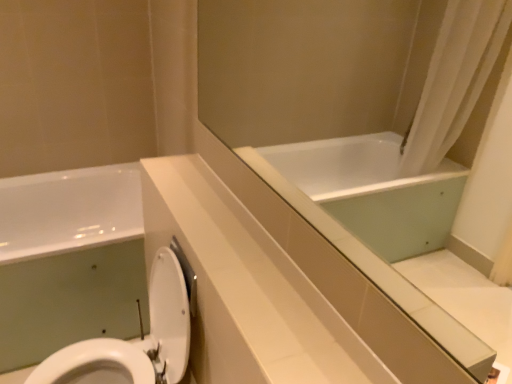
Describe the element at coordinates (69, 260) in the screenshot. I see `white glossy bathtub at lower left` at that location.

Locate an element on the screen. white glossy toilet at lower left is located at coordinates click(x=133, y=340).

From a real-world perspective, does white glossy counter top at center sit lower than white glossy toilet at lower left?

Actually, white glossy counter top at center is physically above white glossy toilet at lower left in the real world.

Which object is further away from the camera, white glossy counter top at center or white glossy toilet at lower left?

white glossy toilet at lower left is behind.

How many degrees apart are the facing directions of white glossy counter top at center and white glossy toilet at lower left?

The facing directions of white glossy counter top at center and white glossy toilet at lower left are 0.35 degrees apart.

Which of these two, white glossy counter top at center or white glossy toilet at lower left, stands shorter?

white glossy counter top at center is shorter.

From a real-world perspective, which is physically above, white glossy toilet at lower left or white glossy bathtub at lower left?

From a 3D spatial view, white glossy toilet at lower left is above.

Is white glossy toilet at lower left facing away from white glossy bathtub at lower left?

white glossy toilet at lower left does not have its back to white glossy bathtub at lower left.

Based on the photo, is white glossy toilet at lower left thinner than white glossy bathtub at lower left?

Correct, the width of white glossy toilet at lower left is less than that of white glossy bathtub at lower left.

From a real-world perspective, between white glossy toilet at lower left and white glossy counter top at center, who is vertically lower?

From a 3D spatial view, white glossy toilet at lower left is below.

Is white glossy toilet at lower left far from white glossy counter top at center?

No.

From a real-world perspective, who is located higher, white glossy bathtub at lower left or white glossy counter top at center?

white glossy counter top at center is physically above.

Which object is positioned more to the right, white glossy bathtub at lower left or white glossy counter top at center?

white glossy counter top at center is more to the right.

Is white glossy bathtub at lower left far from white glossy counter top at center?

white glossy bathtub at lower left is near white glossy counter top at center, not far away.

How many degrees apart are the facing directions of white glossy bathtub at lower left and white glossy counter top at center?

The facing directions of white glossy bathtub at lower left and white glossy counter top at center are 89.7 degrees apart.

Is white glossy bathtub at lower left wider or thinner than white glossy toilet at lower left?

Considering their sizes, white glossy bathtub at lower left looks broader than white glossy toilet at lower left.

Between white glossy bathtub at lower left and white glossy toilet at lower left, which one has more height?

Standing taller between the two is white glossy toilet at lower left.

Which is more to the left, white glossy bathtub at lower left or white glossy toilet at lower left?

From the viewer's perspective, white glossy bathtub at lower left appears more on the left side.

Is the surface of white glossy bathtub at lower left in direct contact with white glossy toilet at lower left?

white glossy bathtub at lower left is not next to white glossy toilet at lower left, and they're not touching.

In the scene shown: How different are the orientations of white glossy counter top at center and white glossy bathtub at lower left in degrees?

white glossy counter top at center and white glossy bathtub at lower left are facing 89.7 degrees away from each other.

Between white glossy counter top at center and white glossy bathtub at lower left, which one is positioned behind?

white glossy bathtub at lower left is further away from the camera.

Locate an element on the screen. The width and height of the screenshot is (512, 384). bath that is behind the white glossy counter top at center is located at coordinates (69, 260).

Does white glossy counter top at center appear on the right side of white glossy bathtub at lower left?

Yes.

The height and width of the screenshot is (384, 512). Find the location of `counter top that is above the white glossy toilet at lower left (from the image's perspective)`. counter top that is above the white glossy toilet at lower left (from the image's perspective) is located at coordinates (247, 288).

This screenshot has width=512, height=384. I want to click on bath below the white glossy toilet at lower left (from a real-world perspective), so click(x=69, y=260).

Looking at the image, which one is located closer to white glossy bathtub at lower left, white glossy counter top at center or white glossy toilet at lower left?

white glossy toilet at lower left is positioned closer to the anchor white glossy bathtub at lower left.

Based on their spatial positions, is white glossy counter top at center or white glossy bathtub at lower left further from white glossy toilet at lower left?

white glossy bathtub at lower left.

Based on the photo, when comparing their distances from white glossy counter top at center, does white glossy bathtub at lower left or white glossy toilet at lower left seem closer?

white glossy toilet at lower left.

Looking at the image, which one is located further to white glossy toilet at lower left, white glossy bathtub at lower left or white glossy counter top at center?

Among the two, white glossy bathtub at lower left is located further to white glossy toilet at lower left.

Looking at the image, which one is located further to white glossy counter top at center, white glossy toilet at lower left or white glossy bathtub at lower left?

Based on the image, white glossy bathtub at lower left appears to be further to white glossy counter top at center.

From the picture: From the image, which object appears to be nearer to white glossy bathtub at lower left, white glossy toilet at lower left or white glossy counter top at center?

white glossy toilet at lower left lies closer to white glossy bathtub at lower left than the other object.

At what (x,y) coordinates should I click in order to perform the action: click on toilet positioned between white glossy counter top at center and white glossy bathtub at lower left from near to far. Please return your answer as a coordinate pair (x, y). This screenshot has width=512, height=384. Looking at the image, I should click on (133, 340).